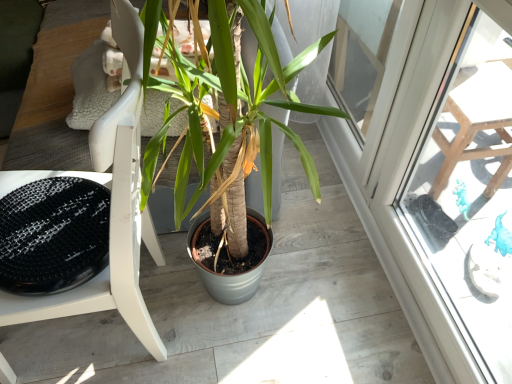
Question: From a real-world perspective, is green matte plant at center under white matte chair at center?

Choices:
 (A) no
 (B) yes

Answer: (B)

Question: Does green matte plant at center have a smaller size compared to white matte chair at center?

Choices:
 (A) no
 (B) yes

Answer: (A)

Question: Does green matte plant at center have a larger size compared to white matte chair at center?

Choices:
 (A) yes
 (B) no

Answer: (A)

Question: Does green matte plant at center have a lesser width compared to white matte chair at center?

Choices:
 (A) yes
 (B) no

Answer: (B)

Question: Can you confirm if green matte plant at center is taller than white matte chair at center?

Choices:
 (A) yes
 (B) no

Answer: (B)

Question: Is the position of green matte plant at center more distant than that of white matte chair at center?

Choices:
 (A) yes
 (B) no

Answer: (A)

Question: Is white matte chair at center further to camera compared to green matte plant at center?

Choices:
 (A) yes
 (B) no

Answer: (B)

Question: From the image's perspective, is white matte chair at center beneath green matte plant at center?

Choices:
 (A) no
 (B) yes

Answer: (B)

Question: Is green matte plant at center surrounded by white matte chair at center?

Choices:
 (A) no
 (B) yes

Answer: (A)

Question: Is white matte chair at center to the right of green matte plant at center from the viewer's perspective?

Choices:
 (A) yes
 (B) no

Answer: (A)

Question: Could you tell me if white matte chair at center is facing green matte plant at center?

Choices:
 (A) yes
 (B) no

Answer: (B)

Question: Can you confirm if white matte chair at center is wider than green matte plant at center?

Choices:
 (A) yes
 (B) no

Answer: (B)

Question: From the image's perspective, is green matte plant at center above or below white matte chair at center?

Choices:
 (A) below
 (B) above

Answer: (B)